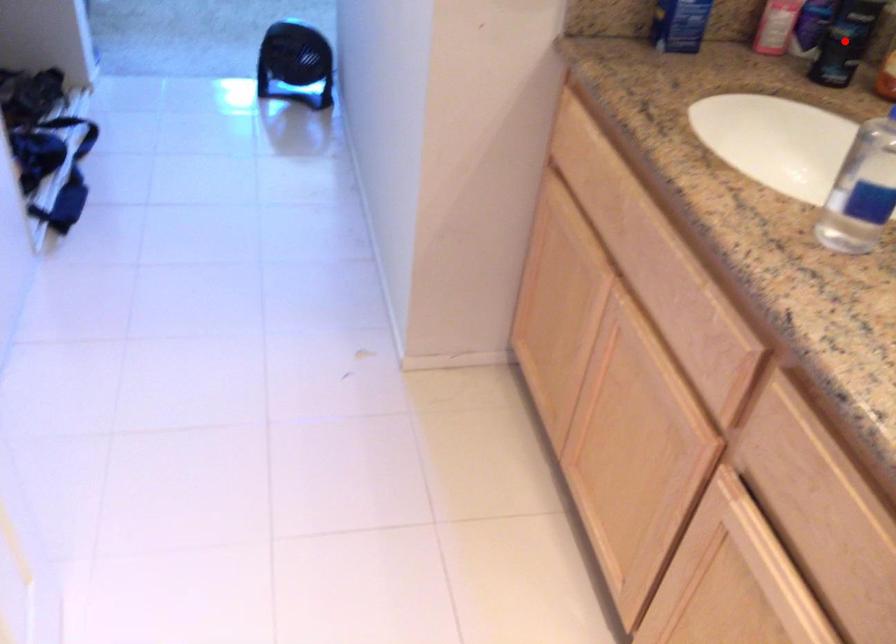
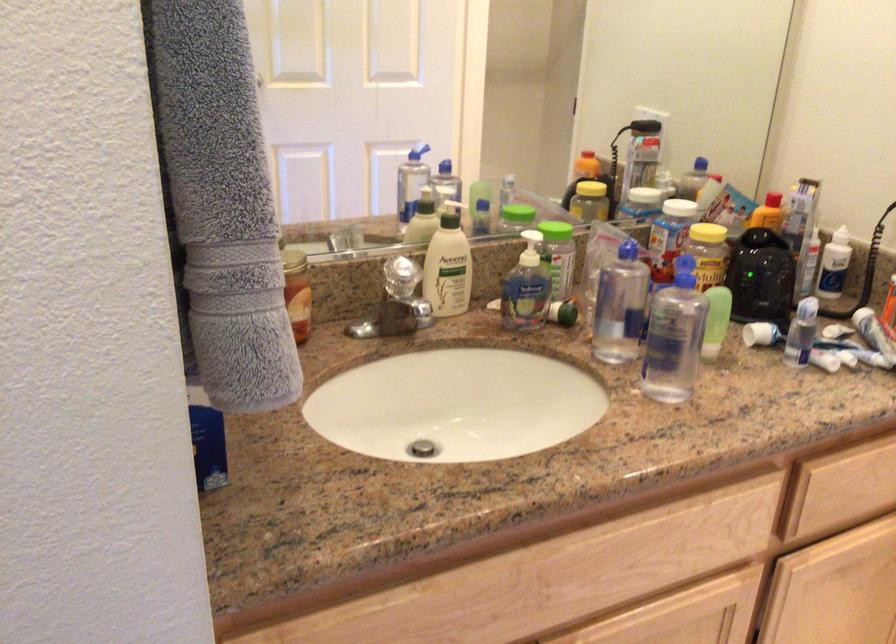
Question: I am providing you with two images of the same scene from different viewpoints. A red point is marked on the first image. Is the red point's position out of view in image 2?

Choices:
 (A) Yes
 (B) No

Answer: (A)